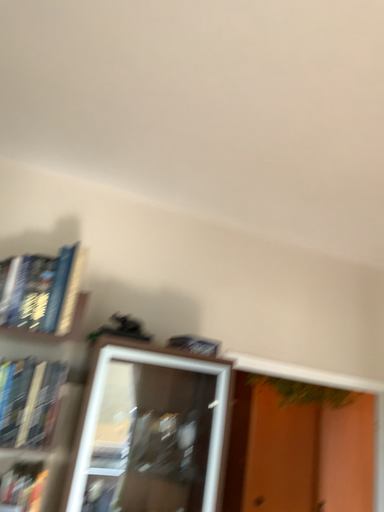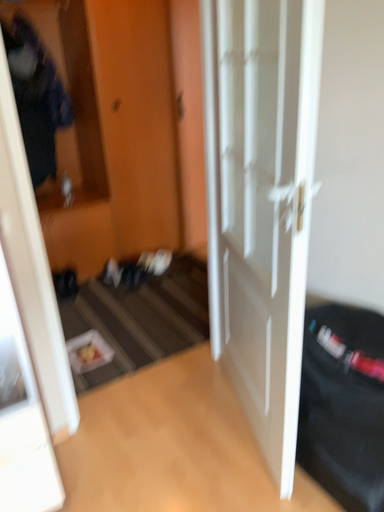
Question: How did the camera likely rotate when shooting the video?

Choices:
 (A) rotated right
 (B) rotated left

Answer: (A)